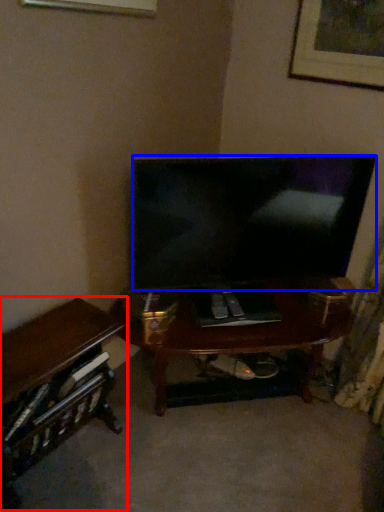
Question: Which object is closer to the camera taking this photo, desk (highlighted by a red box) or television (highlighted by a blue box)?

Choices:
 (A) desk
 (B) television

Answer: (A)